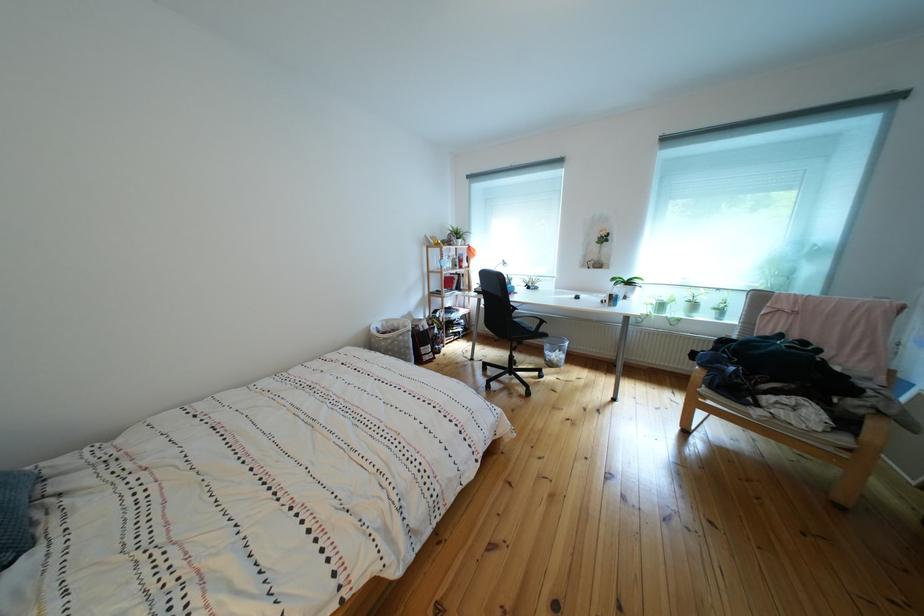
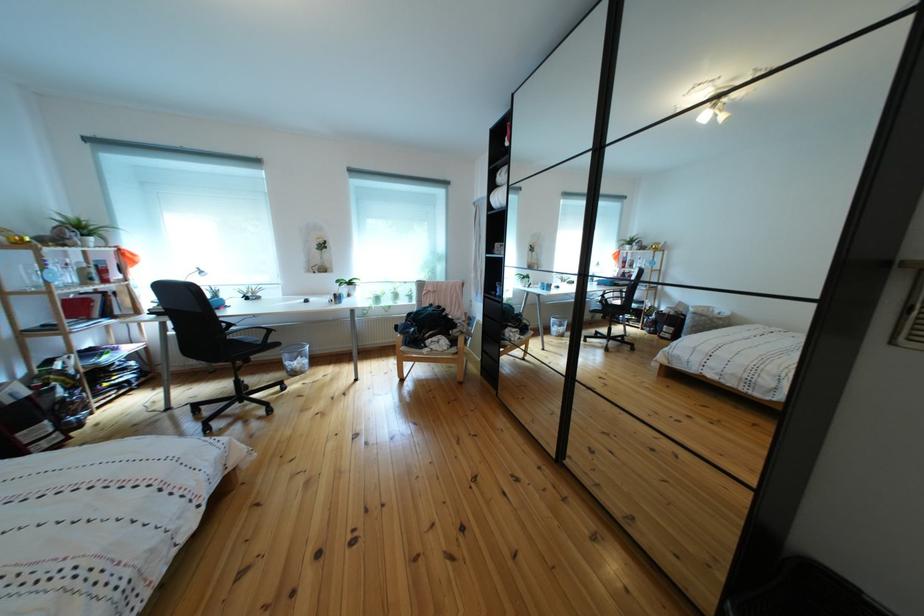
The point at (x=558, y=352) is marked in the first image. Where is the corresponding point in the second image?

(297, 362)